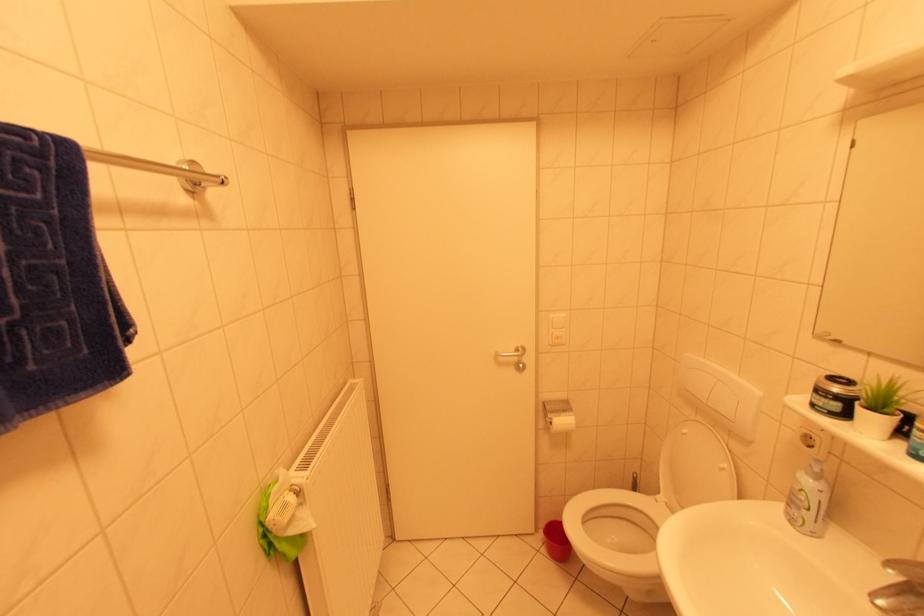
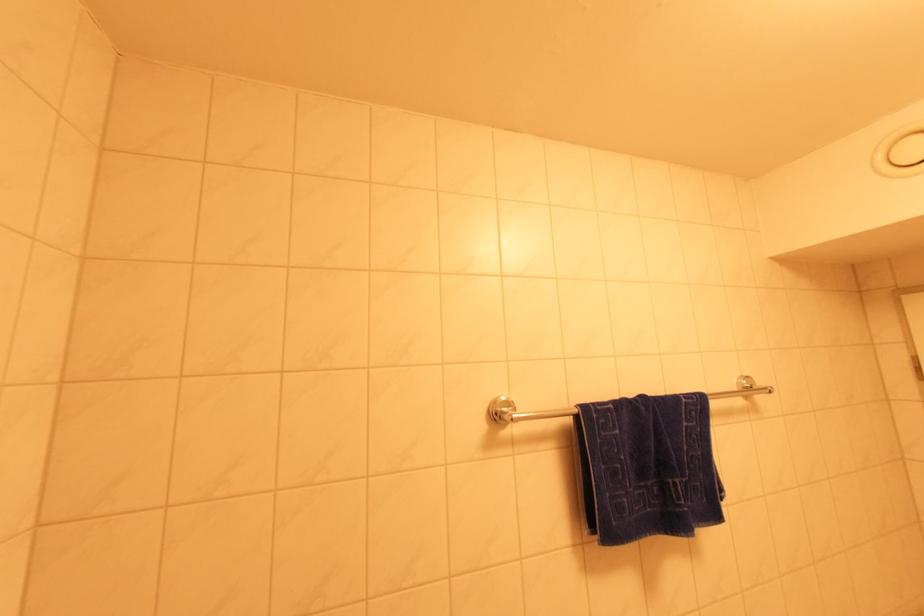
Question: The camera is either moving clockwise (left) or counter-clockwise (right) around the object. The first image is from the beginning of the video and the second image is from the end. Is the camera moving left or right when shooting the video?

Choices:
 (A) Left
 (B) Right

Answer: (B)